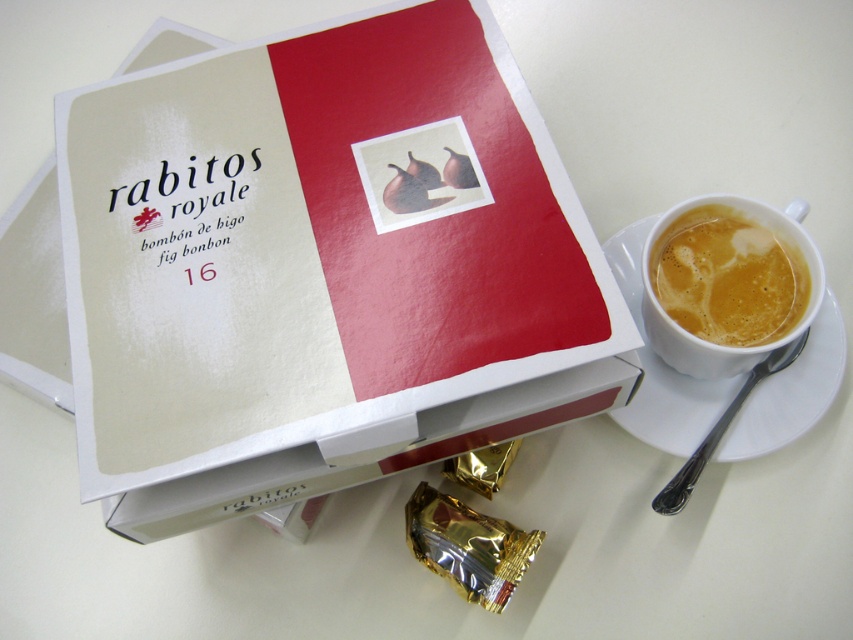
You are organizing items on a table and need to know which item takes up more horizontal space. Based on the scene, which object is wider between the white paper book at upper center and the white frothy liquid at upper right?

The white paper book at upper center is wider than the white frothy liquid at upper right according to the description.

You are organizing items on a table and need to place a 15 inch wide gift box between the white paper book at upper center and the white ceramic saucer at right. Is there enough space between them to fit the gift box?

The distance between the white paper book at upper center and the white ceramic saucer at right is 14.89 inches, which is slightly less than the 15 inch width of the gift box. Therefore, there is not enough space to fit the gift box between them.

You are placing a small toy car on the table. The toy car is 0.1 meters long. The white ceramic saucer at right is located at point 0.573, 0.777. If you want to place the toy car so that it is exactly 0.2 meters away from the saucer, where should you place it?

The toy car should be placed 0.2 meters away from the white ceramic saucer at right, which is located at point (662, 365). The exact coordinates depend on the direction chosen, but maintaining that distance ensures proper placement.